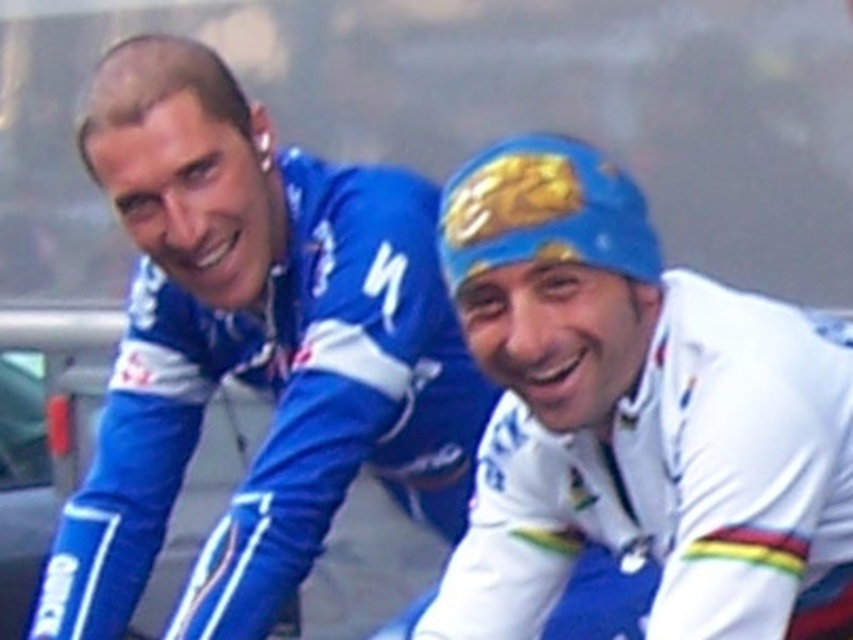
Question: From the image, what is the correct spatial relationship of matte blue jersey at upper left in relation to white glossy jersey at center?

Choices:
 (A) right
 (B) left

Answer: (B)

Question: Among these points, which one is farthest from the camera?

Choices:
 (A) (453, 561)
 (B) (421, 404)

Answer: (B)

Question: Does matte blue jersey at upper left appear under white glossy jersey at center?

Choices:
 (A) yes
 (B) no

Answer: (B)

Question: Which object appears closest to the camera in this image?

Choices:
 (A) matte blue jersey at upper left
 (B) white glossy jersey at center

Answer: (B)

Question: Is matte blue jersey at upper left behind white glossy jersey at center?

Choices:
 (A) yes
 (B) no

Answer: (A)

Question: Which object appears farthest from the camera in this image?

Choices:
 (A) white glossy jersey at center
 (B) matte blue jersey at upper left

Answer: (B)